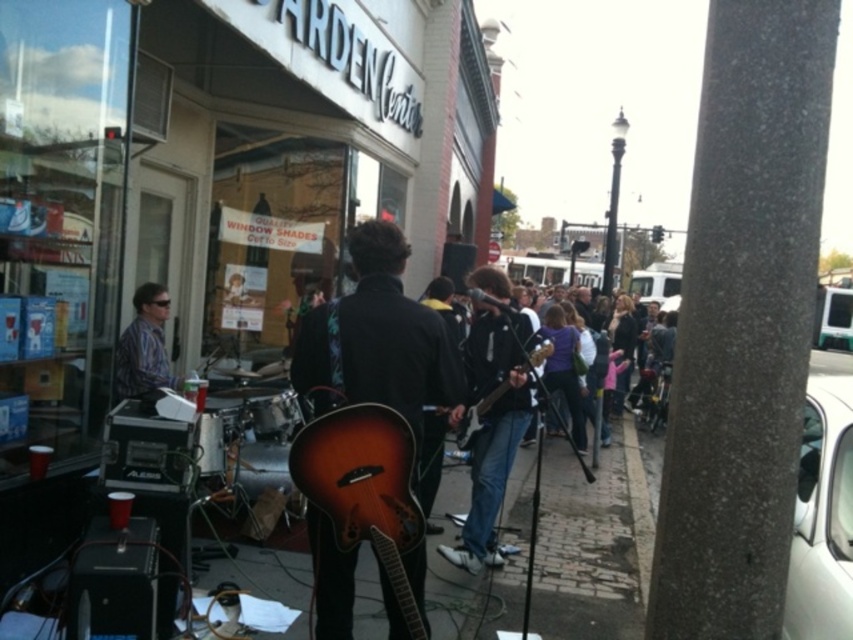
Question: Which point is closer to the camera taking this photo?

Choices:
 (A) (131, 340)
 (B) (386, 529)
 (C) (483, 381)

Answer: (B)

Question: Which point appears closest to the camera in this image?

Choices:
 (A) (497, 390)
 (B) (378, 515)

Answer: (B)

Question: Is wooden acoustic guitar at center positioned in front of satin wood guitar at center?

Choices:
 (A) no
 (B) yes

Answer: (A)

Question: Is satin wood guitar at center smaller than shiny black guitar at center?

Choices:
 (A) yes
 (B) no

Answer: (A)

Question: Which point is farther to the camera?

Choices:
 (A) (128, 392)
 (B) (471, 480)
 (C) (503, 390)

Answer: (B)

Question: Is wooden acoustic guitar at center to the right of shiny black guitar at center from the viewer's perspective?

Choices:
 (A) yes
 (B) no

Answer: (B)